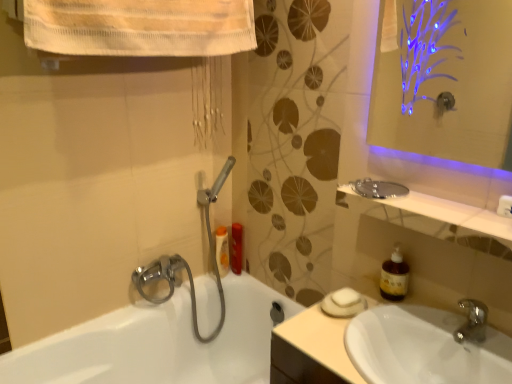
You are a GUI agent. You are given a task and a screenshot of the screen. Output one action in this format:
    pyautogui.click(x=<x>, y=<y>)
    Task: Click on the vacant area located to the right-hand side of white matte soap at sink
    
    Given the screenshot: What is the action you would take?
    pyautogui.click(x=397, y=316)